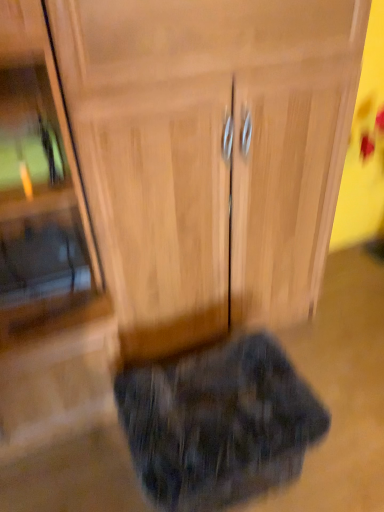
Question: From the image's perspective, would you say wooden cabinet at center is shown under wooden cabinet at center?

Choices:
 (A) yes
 (B) no

Answer: (B)

Question: Is wooden cabinet at center smaller than wooden cabinet at center?

Choices:
 (A) yes
 (B) no

Answer: (B)

Question: From a real-world perspective, is wooden cabinet at center located higher than wooden cabinet at center?

Choices:
 (A) yes
 (B) no

Answer: (A)

Question: Would you say wooden cabinet at center is part of wooden cabinet at center's contents?

Choices:
 (A) no
 (B) yes

Answer: (A)

Question: Are wooden cabinet at center and wooden cabinet at center beside each other?

Choices:
 (A) yes
 (B) no

Answer: (B)

Question: Does wooden cabinet at center lie behind wooden cabinet at center?

Choices:
 (A) no
 (B) yes

Answer: (B)

Question: From a real-world perspective, is fluffy dark gray cat at lower center beneath wooden cabinet at center?

Choices:
 (A) no
 (B) yes

Answer: (B)

Question: Considering the relative positions of fluffy dark gray cat at lower center and wooden cabinet at center in the image provided, is fluffy dark gray cat at lower center to the left of wooden cabinet at center from the viewer's perspective?

Choices:
 (A) no
 (B) yes

Answer: (A)

Question: Is fluffy dark gray cat at lower center outside of wooden cabinet at center?

Choices:
 (A) yes
 (B) no

Answer: (A)

Question: Is fluffy dark gray cat at lower center positioned far away from wooden cabinet at center?

Choices:
 (A) yes
 (B) no

Answer: (B)

Question: Is fluffy dark gray cat at lower center bigger than wooden cabinet at center?

Choices:
 (A) yes
 (B) no

Answer: (B)

Question: Does fluffy dark gray cat at lower center have a smaller size compared to wooden cabinet at center?

Choices:
 (A) yes
 (B) no

Answer: (A)

Question: Is wooden cabinet at center closer to the viewer compared to wooden cabinet at center?

Choices:
 (A) no
 (B) yes

Answer: (B)